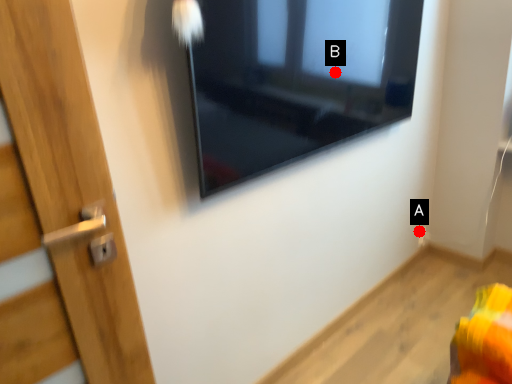
Question: Two points are circled on the image, labeled by A and B beside each circle. Among these points, which one is nearest to the camera?

Choices:
 (A) A is closer
 (B) B is closer

Answer: (B)